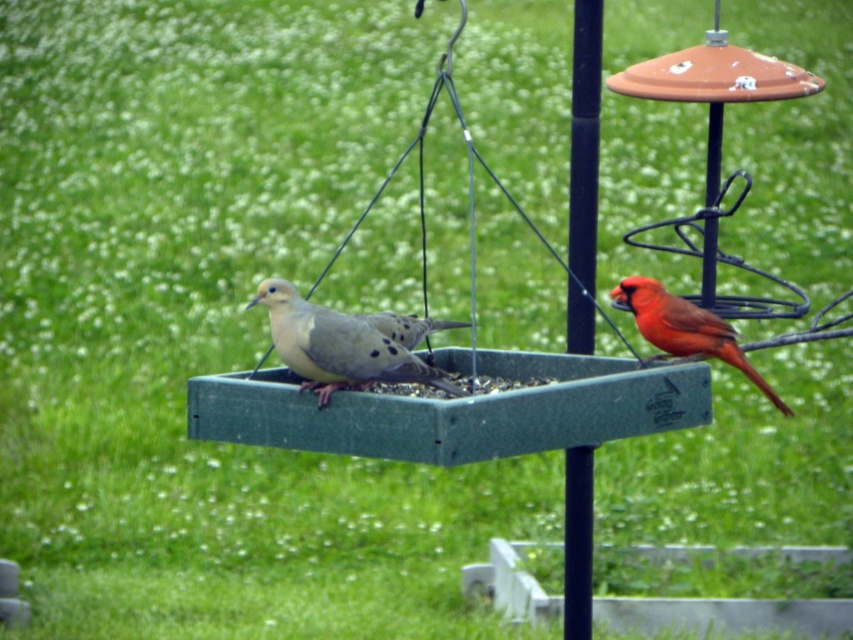
You are a birdwatcher observing the speckled beige dove at center and the shiny red cardinal at right. Which bird has a shorter height?

The speckled beige dove at center is shorter than the shiny red cardinal at right.